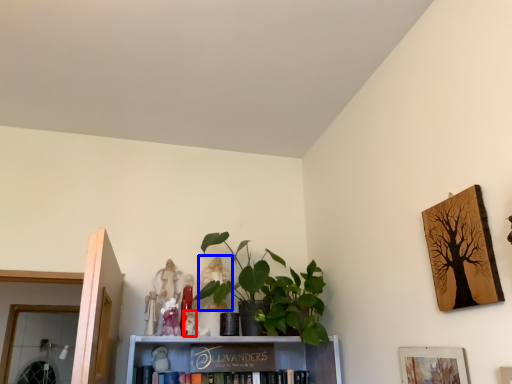
Question: Which of the following is the farthest to the observer, toy (highlighted by a red box) or toy (highlighted by a blue box)?

Choices:
 (A) toy
 (B) toy

Answer: (B)